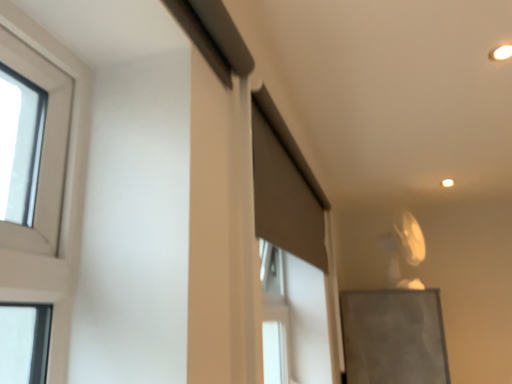
Find the location of a particular element. The image size is (512, 384). matte gray screen door at upper center is located at coordinates (291, 261).

Measure the distance between matte gray screen door at upper center and camera.

The distance of matte gray screen door at upper center from camera is 1.10 meters.

The width and height of the screenshot is (512, 384). Describe the element at coordinates (291, 261) in the screenshot. I see `matte gray screen door at upper center` at that location.

What do you see at coordinates (393, 337) in the screenshot? The width and height of the screenshot is (512, 384). I see `matte gray bulletin board at lower right` at bounding box center [393, 337].

Looking at this image, measure the distance between point (349, 349) and camera.

The depth of point (349, 349) is 7.77 feet.

Where is `matte gray bulletin board at lower right`? matte gray bulletin board at lower right is located at coordinates (393, 337).

This screenshot has height=384, width=512. In order to click on matte gray screen door at upper center in this screenshot , I will do `click(291, 261)`.

Considering the relative positions of matte gray screen door at upper center and matte gray bulletin board at lower right in the image provided, is matte gray screen door at upper center to the left or to the right of matte gray bulletin board at lower right?

Based on their positions, matte gray screen door at upper center is located to the left of matte gray bulletin board at lower right.

Which is behind, matte gray screen door at upper center or matte gray bulletin board at lower right?

Positioned behind is matte gray bulletin board at lower right.

Does point (303, 361) come in front of point (398, 302)?

That is True.

From the image's perspective, does matte gray screen door at upper center appear higher than matte gray bulletin board at lower right?

Yes, from the image's perspective, matte gray screen door at upper center is over matte gray bulletin board at lower right.

From a real-world perspective, is matte gray screen door at upper center positioned above or below matte gray bulletin board at lower right?

Clearly, from a real-world perspective, matte gray screen door at upper center is above matte gray bulletin board at lower right.

Can you confirm if matte gray screen door at upper center is thinner than matte gray bulletin board at lower right?

Yes.

From their relative heights in the image, would you say matte gray screen door at upper center is taller or shorter than matte gray bulletin board at lower right?

Considering their sizes, matte gray screen door at upper center has less height than matte gray bulletin board at lower right.

Considering the sizes of objects matte gray screen door at upper center and matte gray bulletin board at lower right in the image provided, who is smaller, matte gray screen door at upper center or matte gray bulletin board at lower right?

With smaller size is matte gray screen door at upper center.

Is matte gray screen door at upper center situated inside matte gray bulletin board at lower right or outside?

matte gray screen door at upper center is located beyond the bounds of matte gray bulletin board at lower right.

Is matte gray screen door at upper center next to matte gray bulletin board at lower right?

matte gray screen door at upper center is not next to matte gray bulletin board at lower right, and they're not touching.

Is matte gray screen door at upper center positioned with its back to matte gray bulletin board at lower right?

No, matte gray screen door at upper center is not facing the opposite direction of matte gray bulletin board at lower right.

How different are the orientations of matte gray screen door at upper center and matte gray bulletin board at lower right in degrees?

The facing directions of matte gray screen door at upper center and matte gray bulletin board at lower right are 0.0382 degrees apart.

What are the coordinates of `bulletin board lying on the right of matte gray screen door at upper center` in the screenshot? It's located at (393, 337).

Would you say matte gray bulletin board at lower right is to the left or to the right of matte gray screen door at upper center in the picture?

matte gray bulletin board at lower right is to the right of matte gray screen door at upper center.

Relative to matte gray screen door at upper center, is matte gray bulletin board at lower right in front or behind?

In the image, matte gray bulletin board at lower right appears behind matte gray screen door at upper center.

Is point (377, 361) positioned behind point (321, 340)?

That is True.

From the image's perspective, who appears lower, matte gray bulletin board at lower right or matte gray screen door at upper center?

From the image's view, matte gray bulletin board at lower right is below.

From a real-world perspective, is matte gray bulletin board at lower right positioned under matte gray screen door at upper center based on gravity?

Yes.

Which object is wider, matte gray bulletin board at lower right or matte gray screen door at upper center?

matte gray bulletin board at lower right.

From their relative heights in the image, would you say matte gray bulletin board at lower right is taller or shorter than matte gray screen door at upper center?

In the image, matte gray bulletin board at lower right appears to be taller than matte gray screen door at upper center.

Based on their sizes in the image, would you say matte gray bulletin board at lower right is bigger or smaller than matte gray screen door at upper center?

Considering their sizes, matte gray bulletin board at lower right takes up more space than matte gray screen door at upper center.

Is matte gray bulletin board at lower right positioned beyond the bounds of matte gray screen door at upper center?

Yes, matte gray bulletin board at lower right is outside of matte gray screen door at upper center.

Are matte gray bulletin board at lower right and matte gray screen door at upper center located far from each other?

A: No.

Is matte gray bulletin board at lower right positioned with its back to matte gray screen door at upper center?

No, matte gray bulletin board at lower right is not facing away from matte gray screen door at upper center.

Consider the image. How different are the orientations of matte gray bulletin board at lower right and matte gray screen door at upper center in degrees?

0.0382 degrees separate the facing orientations of matte gray bulletin board at lower right and matte gray screen door at upper center.

Locate an element on the screen. The height and width of the screenshot is (384, 512). bulletin board below the matte gray screen door at upper center (from a real-world perspective) is located at coordinates point(393,337).

Find the location of `screen door in front of the matte gray bulletin board at lower right`. screen door in front of the matte gray bulletin board at lower right is located at coordinates (291, 261).

What are the coordinates of `screen door on the left of matte gray bulletin board at lower right` in the screenshot? It's located at (291, 261).